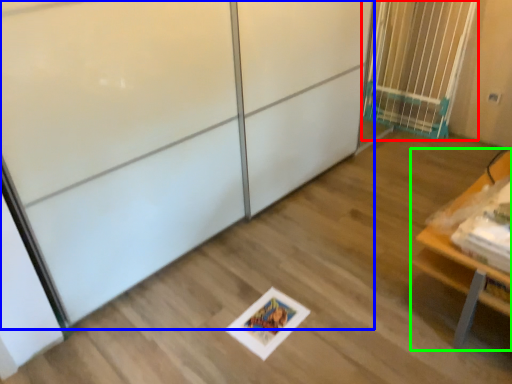
Question: Considering the real-world distances, which object is closest to elevator (highlighted by a red box)? screen door (highlighted by a blue box) or furniture (highlighted by a green box).

Choices:
 (A) screen door
 (B) furniture

Answer: (B)